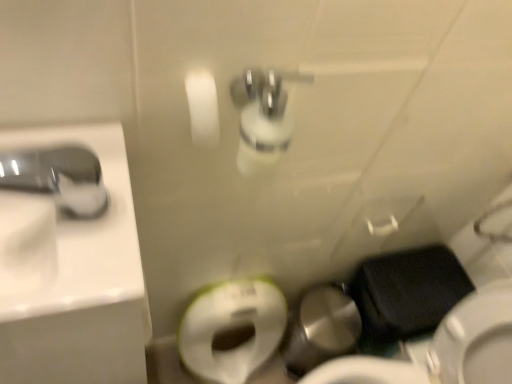
Question: Is point (75, 200) positioned closer to the camera than point (8, 193)?

Choices:
 (A) farther
 (B) closer

Answer: (B)

Question: Based on their sizes in the image, would you say satin nickel faucet at upper left is bigger or smaller than white glossy sink at left?

Choices:
 (A) small
 (B) big

Answer: (A)

Question: Which object is positioned closest to the black matte wallet at lower right?

Choices:
 (A) white glossy sink at left
 (B) satin nickel faucet at upper left

Answer: (A)

Question: Which of these objects is positioned farthest from the black matte wallet at lower right?

Choices:
 (A) white glossy sink at left
 (B) satin nickel faucet at upper left

Answer: (B)